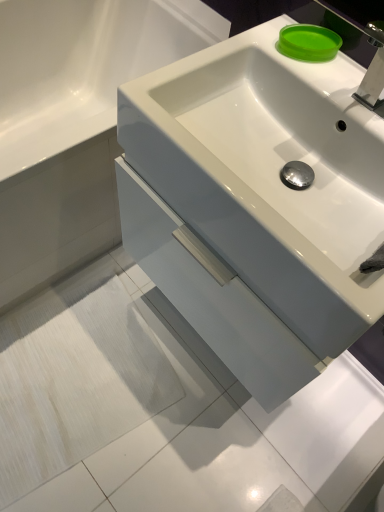
Question: From the image's perspective, is white glossy sink at center on top of green matte soap at upper right?

Choices:
 (A) no
 (B) yes

Answer: (A)

Question: Is white glossy sink at center positioned in front of green matte soap at upper right?

Choices:
 (A) no
 (B) yes

Answer: (B)

Question: Can you confirm if white glossy sink at center is positioned to the left of green matte soap at upper right?

Choices:
 (A) yes
 (B) no

Answer: (A)

Question: Is green matte soap at upper right completely or partially inside white glossy sink at center?

Choices:
 (A) yes
 (B) no

Answer: (B)

Question: Could you tell me if white glossy sink at center is facing green matte soap at upper right?

Choices:
 (A) yes
 (B) no

Answer: (B)

Question: Looking at the image, does white glossy cabinet at center seem bigger or smaller compared to green matte soap at upper right?

Choices:
 (A) small
 (B) big

Answer: (B)

Question: In the image, is white glossy cabinet at center on the left side or the right side of green matte soap at upper right?

Choices:
 (A) left
 (B) right

Answer: (A)

Question: From the image's perspective, is white glossy cabinet at center above or below green matte soap at upper right?

Choices:
 (A) above
 (B) below

Answer: (B)

Question: In terms of width, does white glossy cabinet at center look wider or thinner when compared to green matte soap at upper right?

Choices:
 (A) wide
 (B) thin

Answer: (A)

Question: From the image's perspective, is white glossy sink at center above or below green matte soap at upper right?

Choices:
 (A) below
 (B) above

Answer: (A)

Question: Considering the positions of point (198, 61) and point (314, 26), is point (198, 61) closer or farther from the camera than point (314, 26)?

Choices:
 (A) farther
 (B) closer

Answer: (B)

Question: In the image, is white glossy sink at center on the left side or the right side of green matte soap at upper right?

Choices:
 (A) left
 (B) right

Answer: (A)

Question: Looking at the image, does white glossy sink at center seem bigger or smaller compared to green matte soap at upper right?

Choices:
 (A) small
 (B) big

Answer: (B)

Question: From the image's perspective, relative to white glossy sink at center, is green matte soap at upper right above or below?

Choices:
 (A) below
 (B) above

Answer: (B)

Question: Which is correct: green matte soap at upper right is inside white glossy sink at center, or outside of it?

Choices:
 (A) outside
 (B) inside

Answer: (A)